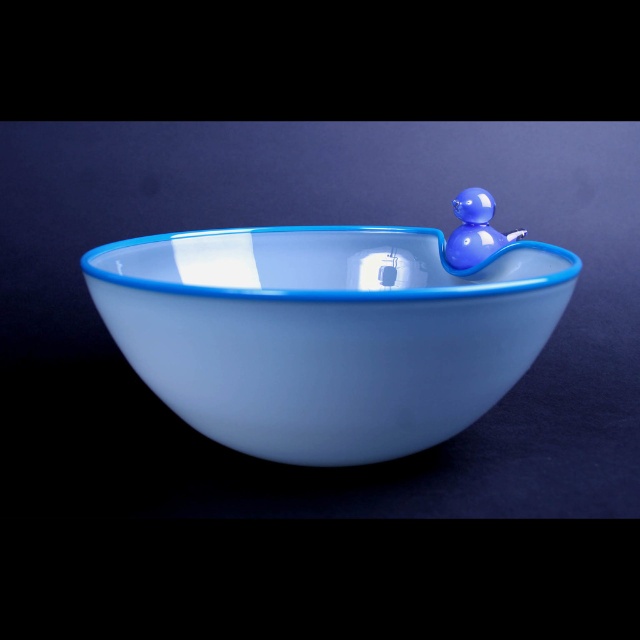
Locate an element on the screen. The width and height of the screenshot is (640, 640). matte glass bowl at center is located at coordinates (326, 332).

Is matte glass bowl at center thinner than glossy plastic duck at upper right?

No, matte glass bowl at center is not thinner than glossy plastic duck at upper right.

Locate an element on the screen. The image size is (640, 640). matte glass bowl at center is located at coordinates (326, 332).